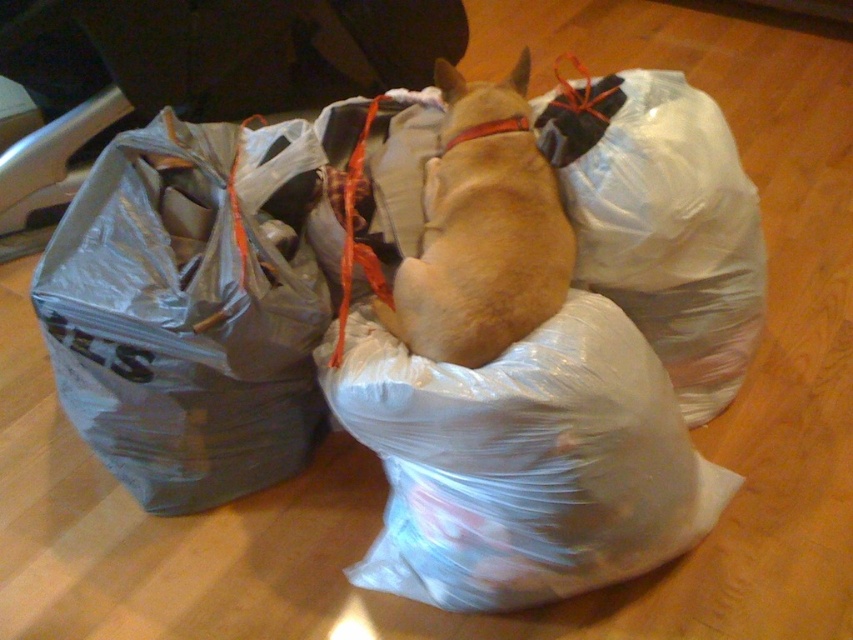
Question: Is clear plastic bag at center in front of light brown fur at center?

Choices:
 (A) no
 (B) yes

Answer: (B)

Question: Is clear plastic bag at center below light brown fur at center?

Choices:
 (A) yes
 (B) no

Answer: (A)

Question: Among these objects, which one is farthest from the camera?

Choices:
 (A) clear plastic bag at center
 (B) light brown fur at center
 (C) gray plastic bag at left

Answer: (B)

Question: Which point is farther from the camera taking this photo?

Choices:
 (A) click(196, 356)
 (B) click(508, 368)

Answer: (A)

Question: Can you confirm if transparent plastic bag at center is bigger than light brown fur at center?

Choices:
 (A) no
 (B) yes

Answer: (B)

Question: Which of the following is the closest to the observer?

Choices:
 (A) gray plastic bag at left
 (B) transparent plastic bag at center
 (C) light brown fur at center

Answer: (B)